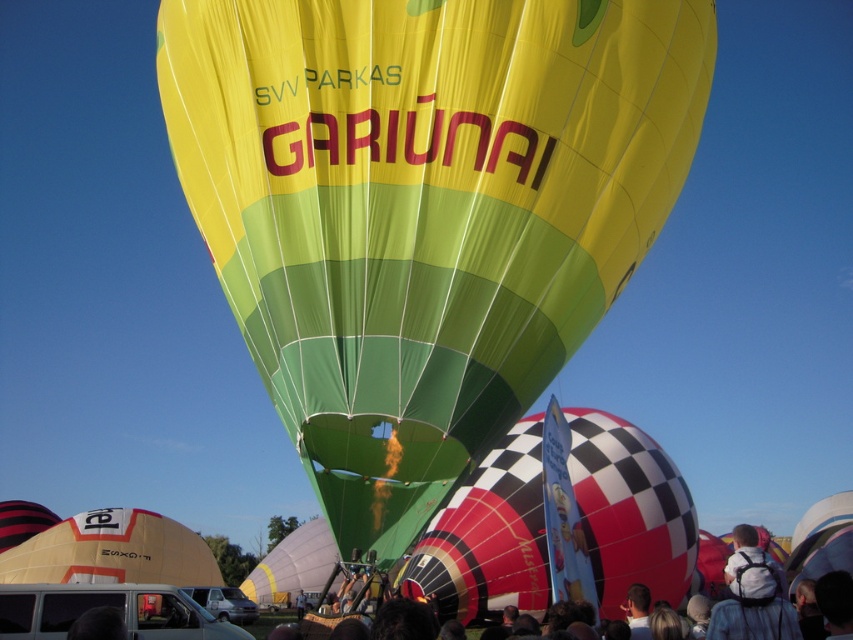
Question: Is matte yellow tent at lower left wider than white backpack at lower right?

Choices:
 (A) yes
 (B) no

Answer: (B)

Question: Is checkered fabric balloon at center to the left of white backpack at lower right from the viewer's perspective?

Choices:
 (A) yes
 (B) no

Answer: (A)

Question: Which of the following is the farthest from the observer?

Choices:
 (A) (177, 557)
 (B) (474, 138)
 (C) (723, 625)

Answer: (A)

Question: Can you confirm if matte yellow tent at lower left is positioned above white backpack at lower right?

Choices:
 (A) no
 (B) yes

Answer: (A)

Question: Which is farther from the checkered fabric balloon at center?

Choices:
 (A) white backpack at lower right
 (B) matte yellow tent at lower left

Answer: (B)

Question: Which point is closer to the camera?

Choices:
 (A) (735, 548)
 (B) (120, 557)
 (C) (524, 483)

Answer: (C)